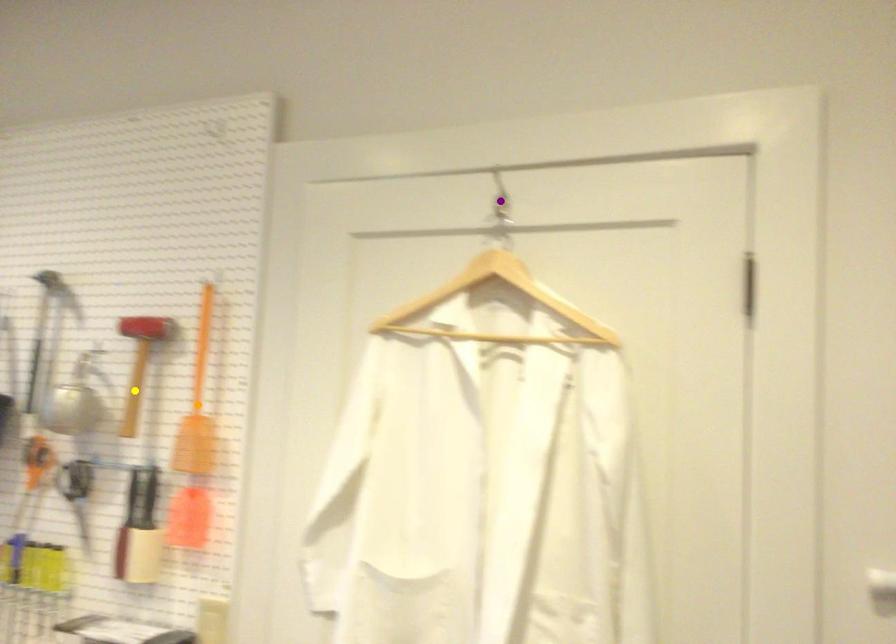
Order these from nearest to farthest:
yellow point
orange point
purple point

purple point < orange point < yellow point